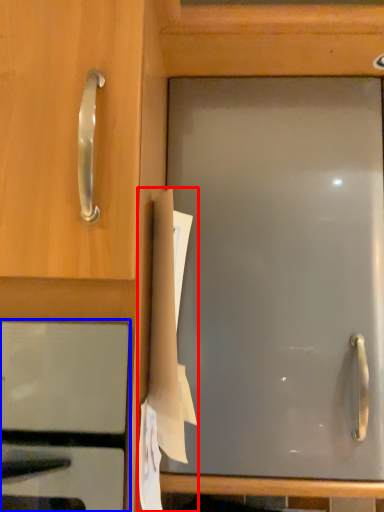
Question: Which object appears closest to the camera in this image, paper (highlighted by a red box) or oven (highlighted by a blue box)?

Choices:
 (A) paper
 (B) oven

Answer: (B)